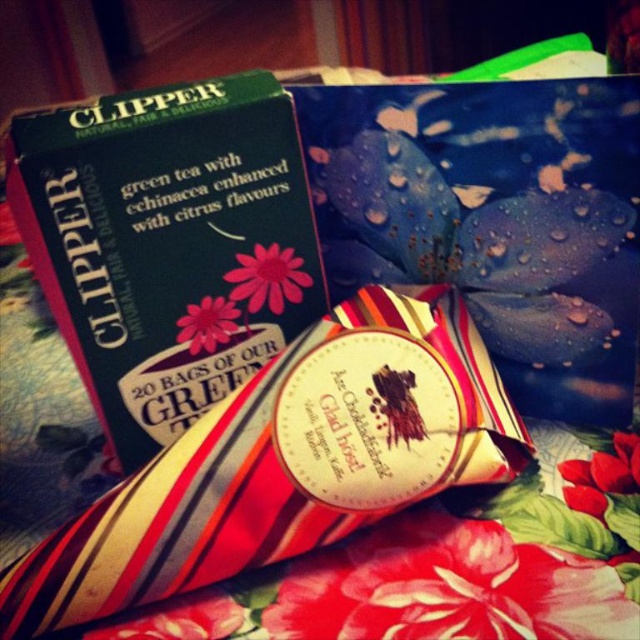
Question: Does green matte box at upper left have a smaller size compared to striped paper cone at center?

Choices:
 (A) no
 (B) yes

Answer: (A)

Question: Which point is closer to the camera taking this photo?

Choices:
 (A) (220, 291)
 (B) (192, 355)
 (C) (264, 298)

Answer: (A)

Question: Is red matte flower at center below pink matte flower at center?

Choices:
 (A) no
 (B) yes

Answer: (B)

Question: Is green matte box at upper left smaller than red matte flower at center?

Choices:
 (A) no
 (B) yes

Answer: (A)

Question: Estimate the real-world distances between objects in this image. Which object is closer to the red matte flower at center?

Choices:
 (A) pink matte flower at center
 (B) pink paper flower at upper left
 (C) green matte box at upper left

Answer: (A)

Question: Which object appears farthest from the camera in this image?

Choices:
 (A) green matte box at upper left
 (B) pink paper flower at upper left
 (C) striped paper cone at center
 (D) red matte flower at center

Answer: (B)